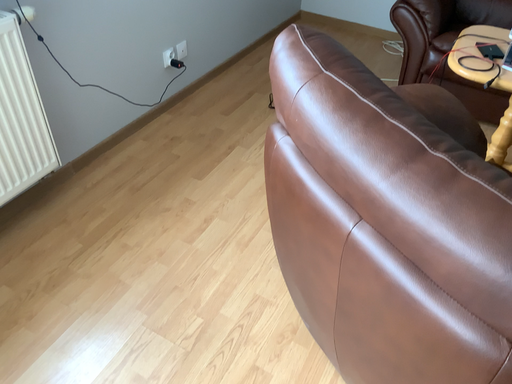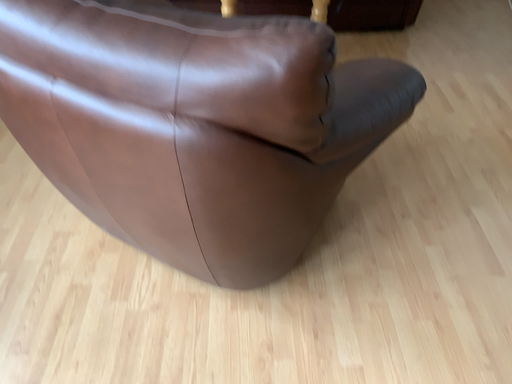
Question: How did the camera likely rotate when shooting the video?

Choices:
 (A) rotated left
 (B) rotated right

Answer: (B)